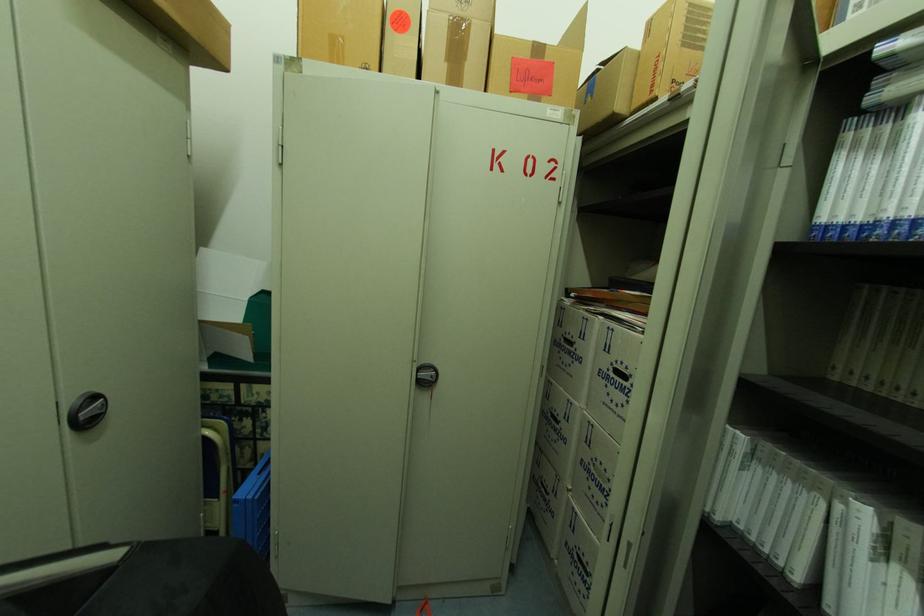
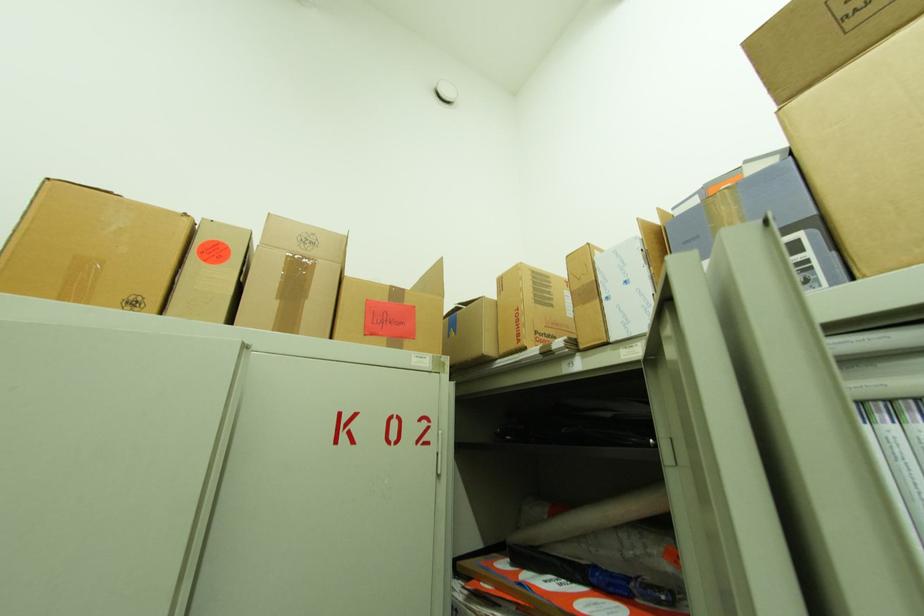
Based on the continuous images, in which direction is the camera rotating?

The camera's rotation is toward right-up.